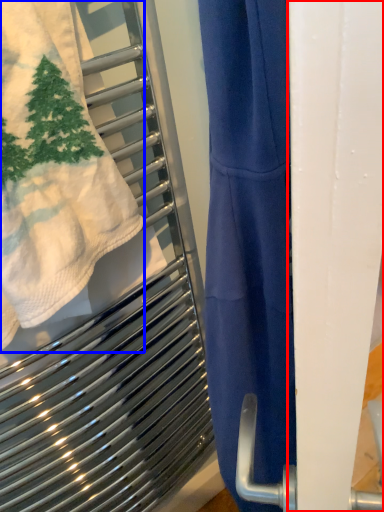
Question: Among these objects, which one is farthest to the camera, screen door (highlighted by a red box) or towel (highlighted by a blue box)?

Choices:
 (A) screen door
 (B) towel

Answer: (B)